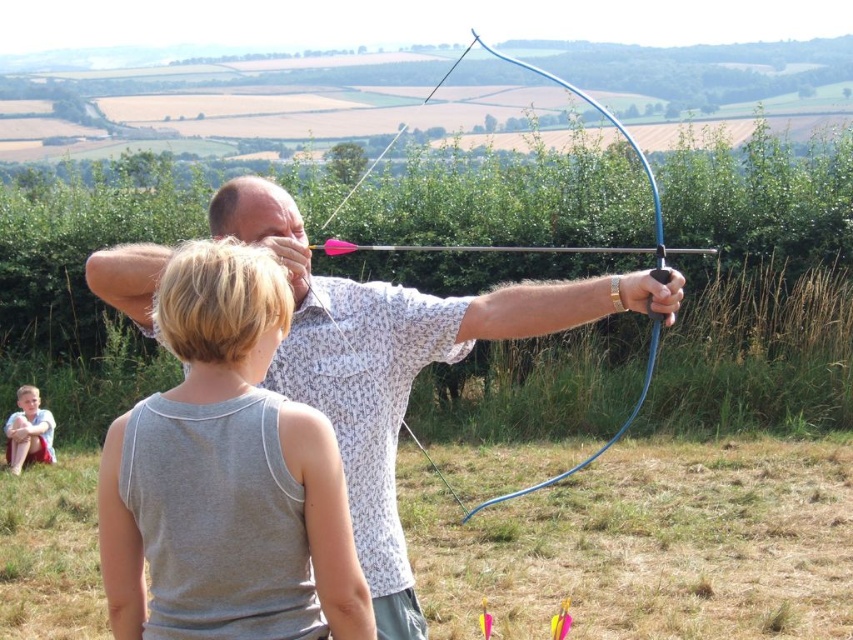
Does matte white bow at center have a smaller size compared to light brown fabric shorts at lower left?

No.

Does point (370, 312) come farther from viewer compared to point (36, 429)?

That is False.

Find the location of `matte white bow at center`. matte white bow at center is located at coordinates (395, 362).

Which is behind, point (221, 387) or point (402, 378)?

The point (402, 378) is behind.

Does gray cotton tank top at center come in front of matte white bow at center?

Yes.

What do you see at coordinates (257, 429) in the screenshot? I see `gray cotton tank top at center` at bounding box center [257, 429].

I want to click on gray cotton tank top at center, so click(257, 429).

Does point (372, 625) come in front of point (19, 440)?

Yes, it is.

Does gray cotton tank top at center have a smaller size compared to light brown fabric shorts at lower left?

Incorrect, gray cotton tank top at center is not smaller in size than light brown fabric shorts at lower left.

You are a GUI agent. You are given a task and a screenshot of the screen. Output one action in this format:
    pyautogui.click(x=<x>, y=<y>)
    Task: Click on the gray cotton tank top at center
    The image size is (853, 640).
    Given the screenshot: What is the action you would take?
    pyautogui.click(x=257, y=429)